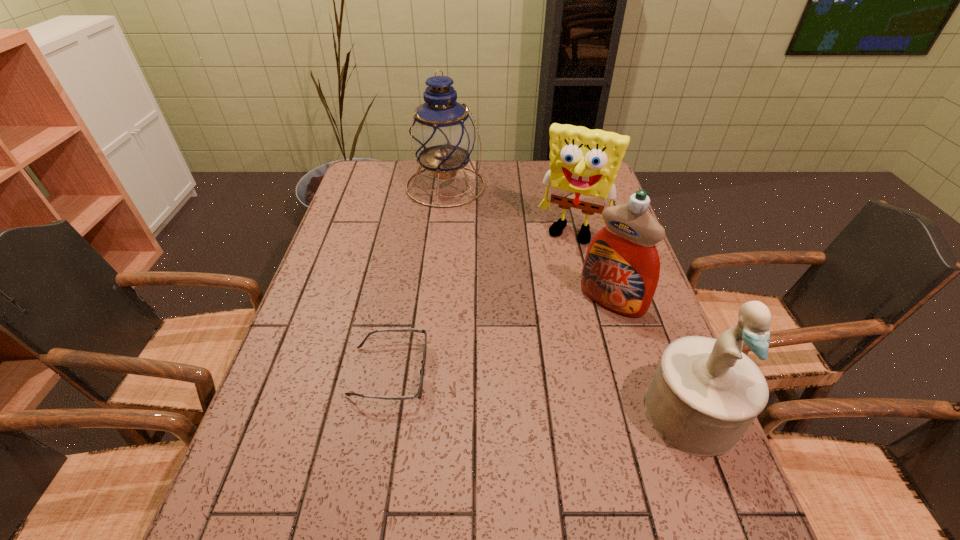
The image size is (960, 540). Find the location of `detergent that is at the right edge`. detergent that is at the right edge is located at coordinates (621, 269).

Where is `object located at the near right corner`? The width and height of the screenshot is (960, 540). object located at the near right corner is located at coordinates tap(705, 394).

The height and width of the screenshot is (540, 960). I want to click on vacant region at the near edge of the desktop, so click(510, 468).

This screenshot has height=540, width=960. Find the location of `vacant space at the left edge of the desktop`. vacant space at the left edge of the desktop is located at coordinates (355, 240).

This screenshot has height=540, width=960. I want to click on vacant space at the right edge of the desktop, so click(660, 316).

Locate an element on the screen. The height and width of the screenshot is (540, 960). blank space at the far left corner of the desktop is located at coordinates (375, 161).

At what (x,y) coordinates should I click in order to perform the action: click on vacant region at the near left corner. Please return your answer as a coordinate pair (x, y). The height and width of the screenshot is (540, 960). Looking at the image, I should click on (261, 464).

Find the location of a particular element. Image resolution: width=960 pixels, height=540 pixels. empty location between the sponge and the lantern is located at coordinates (510, 209).

Where is `free space between the tallest object and the figurine`? The image size is (960, 540). free space between the tallest object and the figurine is located at coordinates (568, 299).

The height and width of the screenshot is (540, 960). What are the coordinates of `free space between the sponge and the figurine` in the screenshot? It's located at (632, 322).